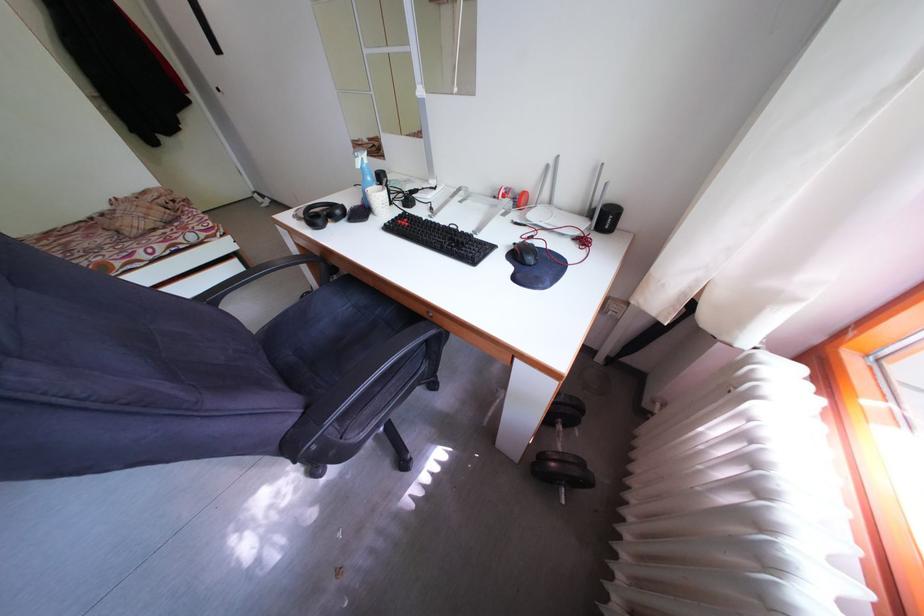
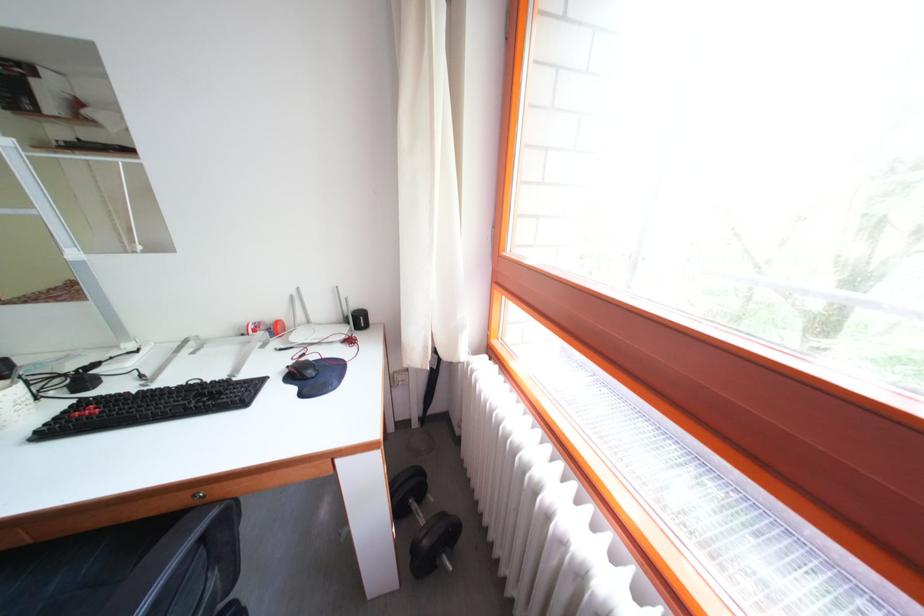
Locate, in the second image, the point that corresponds to point (555, 172) in the first image.

(300, 302)